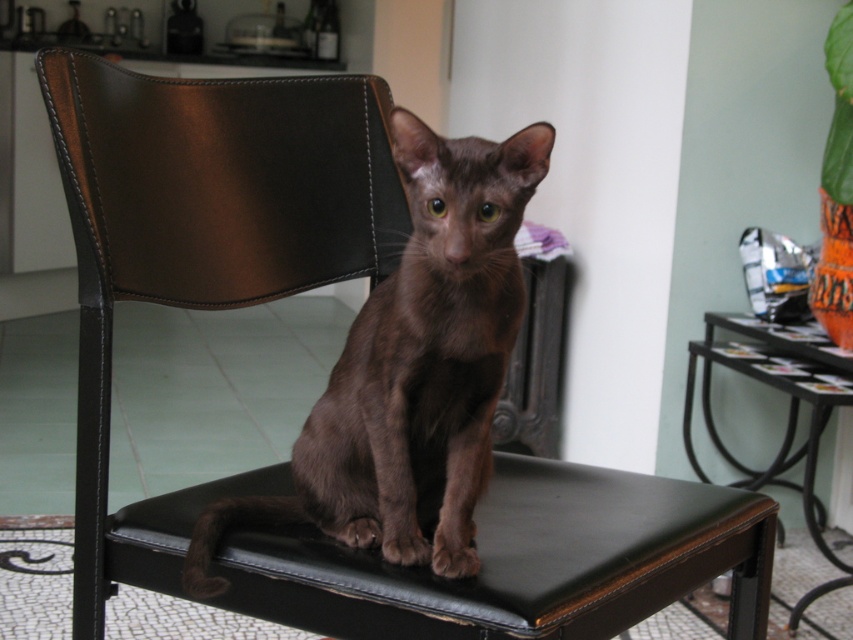
From the picture: Can you confirm if black leather stool at center is wider than brown matte cat at center?

Indeed, black leather stool at center has a greater width compared to brown matte cat at center.

Is black leather stool at center shorter than brown matte cat at center?

Correct, black leather stool at center is not as tall as brown matte cat at center.

Is point (711, 563) positioned behind point (433, 157)?

That is True.

Locate an element on the screen. This screenshot has width=853, height=640. black leather stool at center is located at coordinates (521, 561).